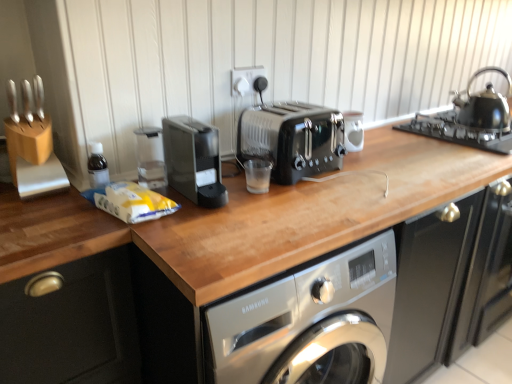
The width and height of the screenshot is (512, 384). I want to click on vacant area on top of wooden at center (from a real-world perspective), so click(250, 210).